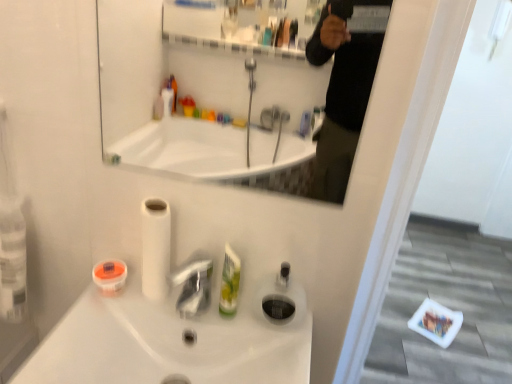
This screenshot has width=512, height=384. What do you see at coordinates (155, 247) in the screenshot?
I see `white matte toilet paper at center` at bounding box center [155, 247].

The height and width of the screenshot is (384, 512). What do you see at coordinates (170, 342) in the screenshot? I see `white glossy sink at center` at bounding box center [170, 342].

Measure the distance between point (288, 297) and camera.

A distance of 35.39 inches exists between point (288, 297) and camera.

Locate an element on the screen. This screenshot has width=512, height=384. orange matte container at lower left, the 2th mouthwash when ordered from right to left is located at coordinates (110, 276).

What do you see at coordinates (229, 283) in the screenshot? I see `green plastic mouthwash at center, which is counted as the second mouthwash, starting from the left` at bounding box center [229, 283].

This screenshot has width=512, height=384. In order to click on green plastic mouthwash at center, which is counted as the second mouthwash, starting from the left in this screenshot , I will do `click(229, 283)`.

Where is `white matte toilet paper at center`? white matte toilet paper at center is located at coordinates (155, 247).

Is transparent plastic soap dispenser at center placed right next to white matte toilet paper at center?

There is a gap between transparent plastic soap dispenser at center and white matte toilet paper at center.

Does transparent plastic soap dispenser at center have a larger size compared to white matte toilet paper at center?

Actually, transparent plastic soap dispenser at center might be smaller than white matte toilet paper at center.

What are the coordinates of `soap dispenser below the white matte toilet paper at center (from a real-world perspective)` in the screenshot? It's located at (282, 297).

Does transparent plastic soap dispenser at center have a greater height compared to white matte toilet paper at center?

In fact, transparent plastic soap dispenser at center may be shorter than white matte toilet paper at center.

Looking at this image, is green plastic mouthwash at center, which is counted as the second mouthwash, starting from the left, next to transparent plastic soap dispenser at center and touching it?

Yes, green plastic mouthwash at center, which is counted as the second mouthwash, starting from the left, is beside transparent plastic soap dispenser at center.

Which of these two, green plastic mouthwash at center, which is counted as the second mouthwash, starting from the left, or transparent plastic soap dispenser at center, stands taller?

Standing taller between the two is green plastic mouthwash at center, which is counted as the second mouthwash, starting from the left.

Between green plastic mouthwash at center, which is counted as the second mouthwash, starting from the left, and transparent plastic soap dispenser at center, which one is positioned behind?

transparent plastic soap dispenser at center.

Is green plastic mouthwash at center, the 1th mouthwash in the right-to-left sequence, wider than transparent plastic soap dispenser at center?

Incorrect, the width of green plastic mouthwash at center, the 1th mouthwash in the right-to-left sequence, does not surpass that of transparent plastic soap dispenser at center.

Considering the positions of point (233, 305) and point (101, 282), is point (233, 305) closer or farther from the camera than point (101, 282)?

Point (233, 305) is closer to the camera than point (101, 282).

Considering the relative positions of green plastic mouthwash at center, the 1th mouthwash in the right-to-left sequence, and orange matte container at lower left, the 1th mouthwash in the left-to-right sequence, in the image provided, is green plastic mouthwash at center, the 1th mouthwash in the right-to-left sequence, to the left of orange matte container at lower left, the 1th mouthwash in the left-to-right sequence, from the viewer's perspective?

In fact, green plastic mouthwash at center, the 1th mouthwash in the right-to-left sequence, is to the right of orange matte container at lower left, the 1th mouthwash in the left-to-right sequence.

From a real-world perspective, is green plastic mouthwash at center, the 1th mouthwash in the right-to-left sequence, positioned over orange matte container at lower left, the 2th mouthwash when ordered from right to left, based on gravity?

Yes, from a real-world perspective, green plastic mouthwash at center, the 1th mouthwash in the right-to-left sequence, is above orange matte container at lower left, the 2th mouthwash when ordered from right to left.

Would you say green plastic mouthwash at center, which is counted as the second mouthwash, starting from the left, contains orange matte container at lower left, the 1th mouthwash in the left-to-right sequence?

That's incorrect, orange matte container at lower left, the 1th mouthwash in the left-to-right sequence, is not inside green plastic mouthwash at center, which is counted as the second mouthwash, starting from the left.

From a real-world perspective, starting from the white glossy sink at center, which mouthwash is the 1st one vertically above it? Please provide its 2D coordinates.

[(110, 276)]

Are orange matte container at lower left, the 1th mouthwash in the left-to-right sequence, and white glossy sink at center far apart?

orange matte container at lower left, the 1th mouthwash in the left-to-right sequence, is actually quite close to white glossy sink at center.

Visually, is orange matte container at lower left, the 1th mouthwash in the left-to-right sequence, positioned to the left or to the right of white glossy sink at center?

From the image, it's evident that orange matte container at lower left, the 1th mouthwash in the left-to-right sequence, is to the left of white glossy sink at center.

From the image's perspective, is orange matte container at lower left, the 2th mouthwash when ordered from right to left, under white glossy sink at center?

Actually, orange matte container at lower left, the 2th mouthwash when ordered from right to left, appears above white glossy sink at center in the image.

Does white glossy sink at center touch transparent plastic soap dispenser at center?

No.

Image resolution: width=512 pixels, height=384 pixels. Find the location of `soap dispenser above the white glossy sink at center (from a real-world perspective)`. soap dispenser above the white glossy sink at center (from a real-world perspective) is located at coordinates (282, 297).

Is white glossy sink at center to the right of transparent plastic soap dispenser at center from the viewer's perspective?

No, white glossy sink at center is not to the right of transparent plastic soap dispenser at center.

Does point (271, 333) appear closer or farther from the camera than point (290, 309)?

Point (271, 333) appears to be closer to the viewer than point (290, 309).

Based on the photo, from the image's perspective, relative to orange matte container at lower left, the 1th mouthwash in the left-to-right sequence, is transparent plastic soap dispenser at center above or below?

transparent plastic soap dispenser at center is below orange matte container at lower left, the 1th mouthwash in the left-to-right sequence.

Does transparent plastic soap dispenser at center appear on the left side of orange matte container at lower left, the 1th mouthwash in the left-to-right sequence?

No, transparent plastic soap dispenser at center is not to the left of orange matte container at lower left, the 1th mouthwash in the left-to-right sequence.

Where is `soap dispenser in front of the orange matte container at lower left, the 2th mouthwash when ordered from right to left`? The height and width of the screenshot is (384, 512). soap dispenser in front of the orange matte container at lower left, the 2th mouthwash when ordered from right to left is located at coordinates (282, 297).

Considering the relative sizes of transparent plastic soap dispenser at center and orange matte container at lower left, the 2th mouthwash when ordered from right to left, in the image provided, is transparent plastic soap dispenser at center smaller than orange matte container at lower left, the 2th mouthwash when ordered from right to left,?

No, transparent plastic soap dispenser at center is not smaller than orange matte container at lower left, the 2th mouthwash when ordered from right to left.

Does orange matte container at lower left, the 2th mouthwash when ordered from right to left, have a greater width compared to transparent plastic soap dispenser at center?

Correct, the width of orange matte container at lower left, the 2th mouthwash when ordered from right to left, exceeds that of transparent plastic soap dispenser at center.

From a real-world perspective, who is located higher, orange matte container at lower left, the 1th mouthwash in the left-to-right sequence, or transparent plastic soap dispenser at center?

From a 3D spatial view, transparent plastic soap dispenser at center is above.

This screenshot has height=384, width=512. In order to click on mouthwash that is under the transparent plastic soap dispenser at center (from a real-world perspective) in this screenshot , I will do `click(110, 276)`.

How much distance is there between orange matte container at lower left, the 1th mouthwash in the left-to-right sequence, and transparent plastic soap dispenser at center?

orange matte container at lower left, the 1th mouthwash in the left-to-right sequence, and transparent plastic soap dispenser at center are 13.72 inches apart from each other.

Image resolution: width=512 pixels, height=384 pixels. I want to click on toilet paper that appears above the transparent plastic soap dispenser at center (from the image's perspective), so click(x=155, y=247).

Image resolution: width=512 pixels, height=384 pixels. What are the coordinates of `soap dispenser below the green plastic mouthwash at center, which is counted as the second mouthwash, starting from the left (from the image's perspective)` in the screenshot? It's located at (282, 297).

Estimate the real-world distances between objects in this image. Which object is closer to transparent plastic soap dispenser at center, orange matte container at lower left, the 2th mouthwash when ordered from right to left, or white matte toilet paper at center?

white matte toilet paper at center is closer to transparent plastic soap dispenser at center.

Which object lies nearer to the anchor point white matte toilet paper at center, white glossy mirror at upper center or orange matte container at lower left, the 1th mouthwash in the left-to-right sequence?

orange matte container at lower left, the 1th mouthwash in the left-to-right sequence, is closer to white matte toilet paper at center.

Considering their positions, is orange matte container at lower left, the 1th mouthwash in the left-to-right sequence, positioned further to white glossy sink at center than white glossy mirror at upper center?

Based on the image, white glossy mirror at upper center appears to be further to white glossy sink at center.

Considering their positions, is white glossy sink at center positioned closer to transparent plastic soap dispenser at center than white glossy mirror at upper center?

white glossy sink at center lies closer to transparent plastic soap dispenser at center than the other object.

Considering their positions, is white glossy sink at center positioned closer to orange matte container at lower left, the 1th mouthwash in the left-to-right sequence, than transparent plastic soap dispenser at center?

The object closer to orange matte container at lower left, the 1th mouthwash in the left-to-right sequence, is white glossy sink at center.

Considering their positions, is white matte toilet paper at center positioned further to orange matte container at lower left, the 2th mouthwash when ordered from right to left, than white glossy mirror at upper center?

Among the two, white glossy mirror at upper center is located further to orange matte container at lower left, the 2th mouthwash when ordered from right to left.

Considering their positions, is white matte toilet paper at center positioned further to transparent plastic soap dispenser at center than green plastic mouthwash at center, which is counted as the second mouthwash, starting from the left?

white matte toilet paper at center lies further to transparent plastic soap dispenser at center than the other object.

From the image, which object appears to be farther from orange matte container at lower left, the 1th mouthwash in the left-to-right sequence, green plastic mouthwash at center, which is counted as the second mouthwash, starting from the left, or transparent plastic soap dispenser at center?

The object further to orange matte container at lower left, the 1th mouthwash in the left-to-right sequence, is transparent plastic soap dispenser at center.

At what (x,y) coordinates should I click in order to perform the action: click on toilet paper between white glossy sink at center and orange matte container at lower left, the 2th mouthwash when ordered from right to left, in the front-back direction. Please return your answer as a coordinate pair (x, y). Looking at the image, I should click on (155, 247).

You are a GUI agent. You are given a task and a screenshot of the screen. Output one action in this format:
    pyautogui.click(x=<x>, y=<y>)
    Task: Click on the mouthwash situated between white matte toilet paper at center and transparent plastic soap dispenser at center from left to right
    Image resolution: width=512 pixels, height=384 pixels.
    Given the screenshot: What is the action you would take?
    pyautogui.click(x=229, y=283)

Where is `mouthwash between white glossy mirror at upper center and green plastic mouthwash at center, which is counted as the second mouthwash, starting from the left, vertically`? Image resolution: width=512 pixels, height=384 pixels. mouthwash between white glossy mirror at upper center and green plastic mouthwash at center, which is counted as the second mouthwash, starting from the left, vertically is located at coordinates (110, 276).

This screenshot has height=384, width=512. I want to click on toilet paper between white glossy mirror at upper center and green plastic mouthwash at center, which is counted as the second mouthwash, starting from the left, from top to bottom, so click(155, 247).